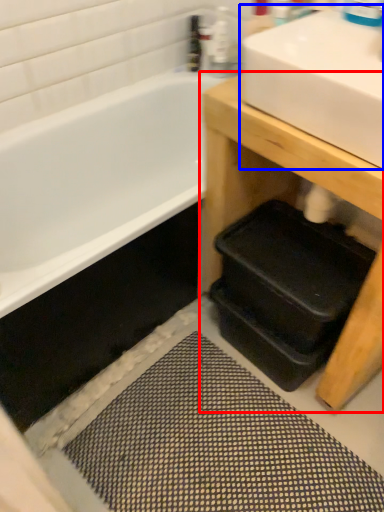
Question: Which of the following is the farthest to the observer, table (highlighted by a red box) or sink (highlighted by a blue box)?

Choices:
 (A) table
 (B) sink

Answer: (A)